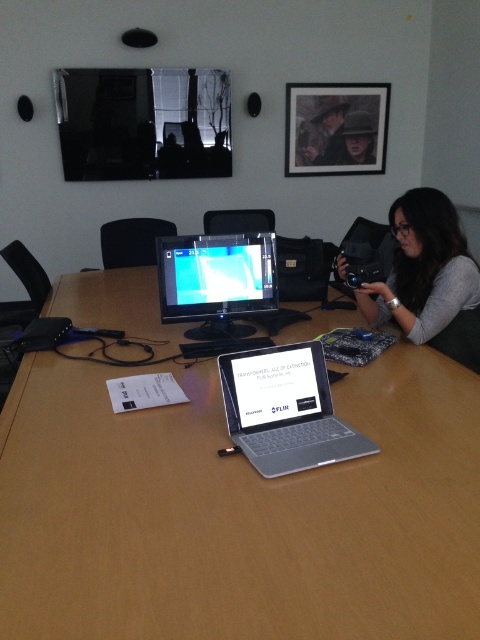
Question: Among these objects, which one is farthest from the camera?

Choices:
 (A) matte black hat at upper center
 (B) leather jacket at upper center
 (C) wooden table at center

Answer: (A)

Question: Which object appears closest to the camera in this image?

Choices:
 (A) matte black hat at upper center
 (B) leather jacket at upper center
 (C) silver metallic laptop at center
 (D) matte black camera at right

Answer: (C)

Question: Does silver metallic laptop at center appear on the left side of matte black hat at upper center?

Choices:
 (A) no
 (B) yes

Answer: (B)

Question: Estimate the real-world distances between objects in this image. Which object is closer to the leather jacket at upper center?

Choices:
 (A) matte black monitor at center
 (B) silver metallic laptop at center

Answer: (A)

Question: Does silver metallic laptop at center come in front of leather jacket at upper center?

Choices:
 (A) no
 (B) yes

Answer: (B)

Question: Is wooden table at center to the left of matte black camera at right from the viewer's perspective?

Choices:
 (A) no
 (B) yes

Answer: (B)